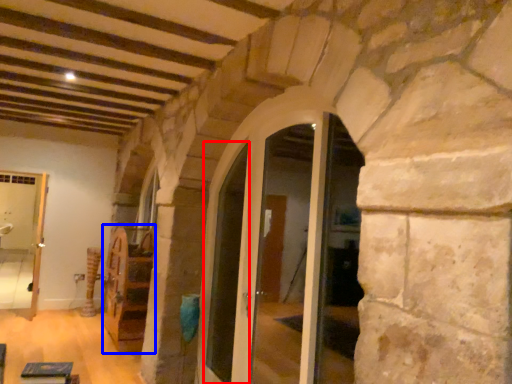
Question: Among these objects, which one is nearest to the camera, door (highlighted by a red box) or furniture (highlighted by a blue box)?

Choices:
 (A) door
 (B) furniture

Answer: (A)